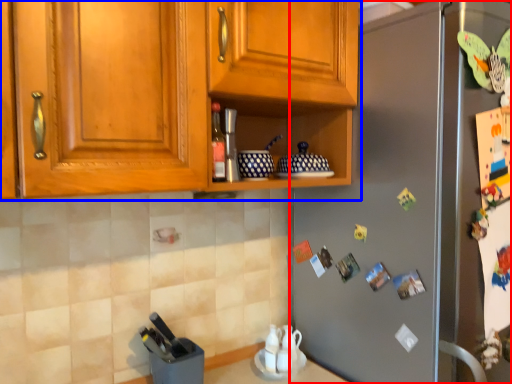
Question: Which object appears closest to the camera in this image, refrigerator (highlighted by a red box) or cabinetry (highlighted by a blue box)?

Choices:
 (A) refrigerator
 (B) cabinetry

Answer: (B)